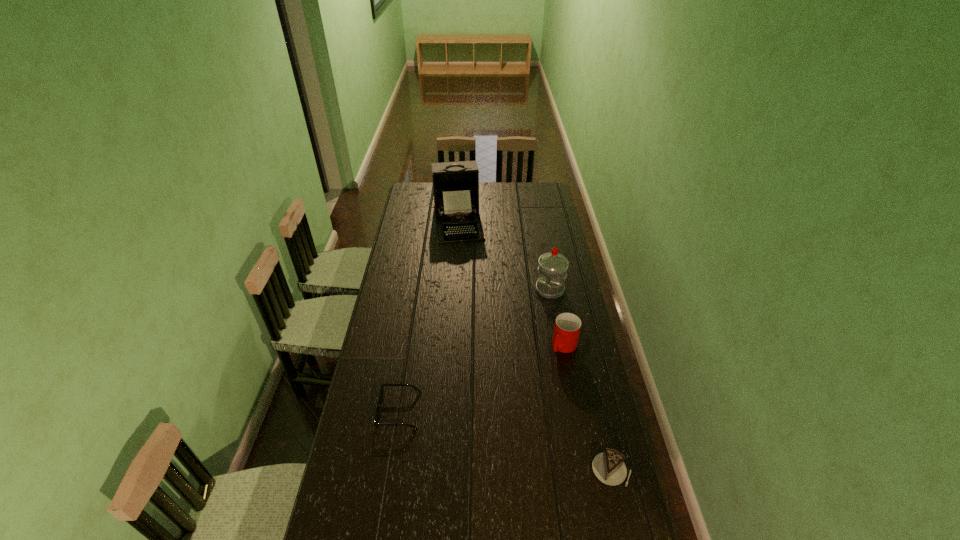
Select which object is the closest to the fourth shortest object. Please provide its 2D coordinates. Your answer should be formatted as a tuple, i.e. [(x, y)], where the tuple contains the x and y coordinates of a point satisfying the conditions above.

[(567, 327)]

The height and width of the screenshot is (540, 960). I want to click on the second closest object to the fourth tallest object, so click(378, 409).

Locate an element on the screen. free spot that satisfies the following two spatial constraints: 1. on the front side of the third tallest object; 2. on the left side of the tallest object is located at coordinates (450, 346).